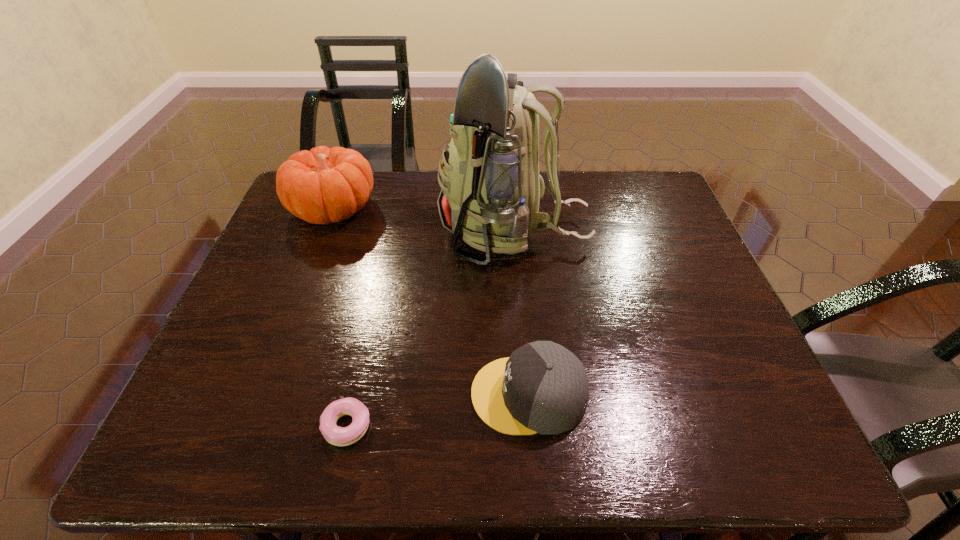
You are a GUI agent. You are given a task and a screenshot of the screen. Output one action in this format:
    pyautogui.click(x=<x>, y=<y>)
    Task: Click on the vacant area that lies between the leftmost object and the backpack
    
    Given the screenshot: What is the action you would take?
    pyautogui.click(x=424, y=220)

The width and height of the screenshot is (960, 540). Identify the location of free space between the doughnut and the cap. (438, 410).

Where is `free space between the second object from left to right and the cap`? This screenshot has height=540, width=960. free space between the second object from left to right and the cap is located at coordinates (438, 410).

Find the location of a particular element. Image resolution: width=960 pixels, height=540 pixels. free point between the third object from right to left and the second tallest object is located at coordinates (340, 318).

Locate an element on the screen. The image size is (960, 540). free point between the leftmost object and the third tallest object is located at coordinates (431, 302).

The image size is (960, 540). Identify the location of object that is the closest to the pumpkin. (490, 184).

Locate which object is the second closest to the tallest object. Please provide its 2D coordinates. Your answer should be formatted as a tuple, i.e. [(x, y)], where the tuple contains the x and y coordinates of a point satisfying the conditions above.

[(543, 388)]

I want to click on free spot that satisfies the following two spatial constraints: 1. on the front-facing side of the second shortest object; 2. on the front side of the doughnut, so click(x=531, y=426).

You are a GUI agent. You are given a task and a screenshot of the screen. Output one action in this format:
    pyautogui.click(x=<x>, y=<y>)
    Task: Click on the vacant space that satisfies the following two spatial constraints: 1. on the front side of the pumpkin; 2. on the left side of the third object from right to left
    The width and height of the screenshot is (960, 540).
    Given the screenshot: What is the action you would take?
    pyautogui.click(x=252, y=426)